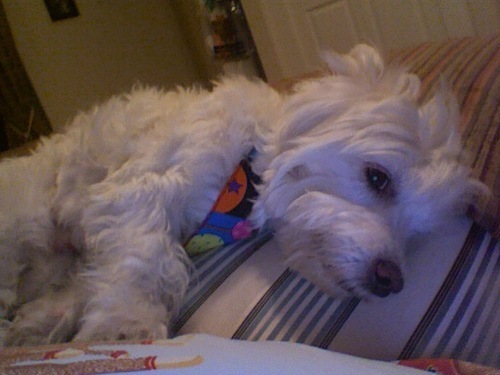
The image size is (500, 375). I want to click on striped fabric, so click(x=260, y=302), click(x=445, y=287), click(x=477, y=61).